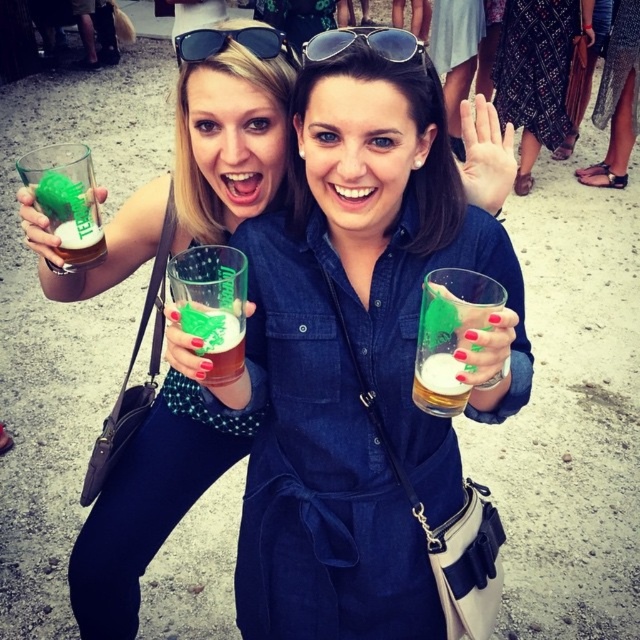
Question: Where is matte glass mug at center located in relation to matte denim dress at center in the image?

Choices:
 (A) left
 (B) right

Answer: (B)

Question: Considering the real-world distances, which object is farthest from the printed fabric dress at center?

Choices:
 (A) green frothy beer at center
 (B) matte green glass at upper left
 (C) translucent glass beer at center

Answer: (A)

Question: Which object is the closest to the sunglasses at center?

Choices:
 (A) matte green glass at upper left
 (B) green frothy beer at center

Answer: (B)

Question: Which point appears farthest from the camera in this image?

Choices:
 (A) (436, 406)
 (B) (444, 157)
 (C) (252, 145)
 (D) (586, 22)

Answer: (D)

Question: Observing the image, what is the correct spatial positioning of sunglasses at center in reference to translucent glass beer at center?

Choices:
 (A) above
 (B) below

Answer: (A)

Question: Is printed fabric dress at center positioned in front of green frosted glass at upper left?

Choices:
 (A) yes
 (B) no

Answer: (B)